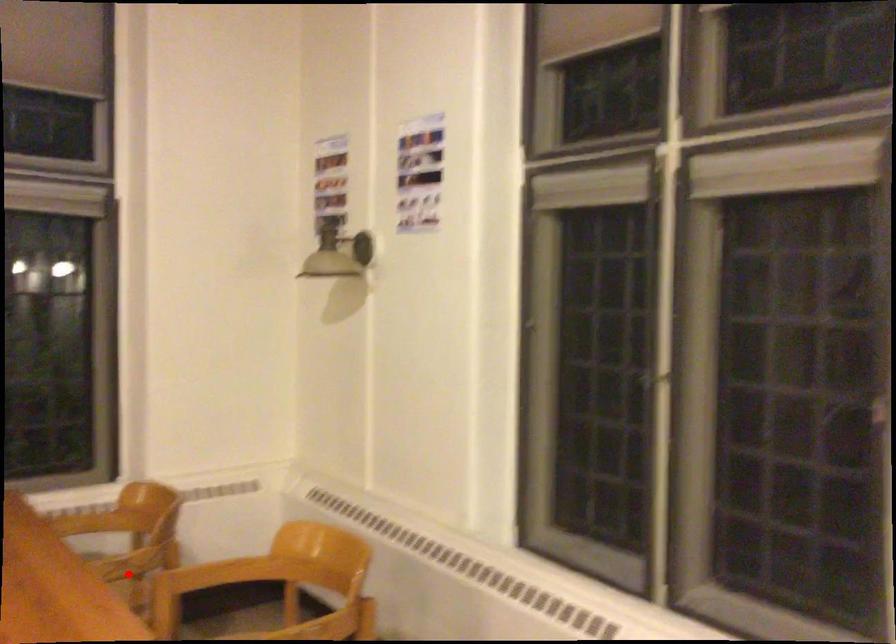
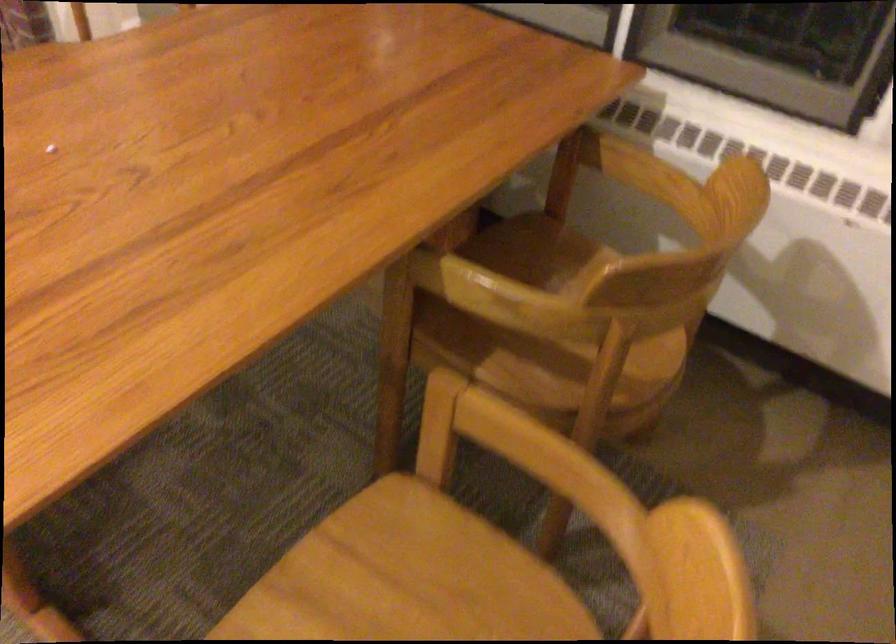
In the second image, find the point that corresponds to the highlighted location in the first image.

(545, 330)